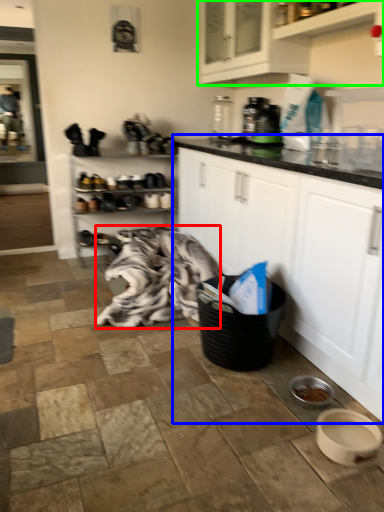
Question: Which is nearer to the blanket (highlighted by a red box)? cabinetry (highlighted by a blue box) or cabinetry (highlighted by a green box).

Choices:
 (A) cabinetry
 (B) cabinetry

Answer: (A)